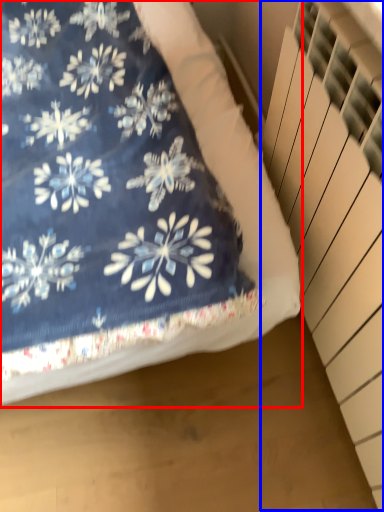
Question: Which object appears farthest to the camera in this image, bed (highlighted by a red box) or stairwell (highlighted by a blue box)?

Choices:
 (A) bed
 (B) stairwell

Answer: (A)